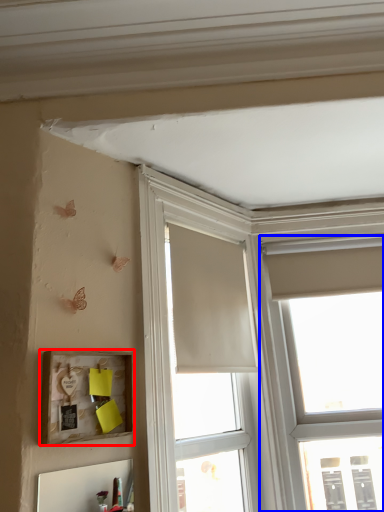
Question: Among these objects, which one is farthest to the camera, picture frame (highlighted by a red box) or window (highlighted by a blue box)?

Choices:
 (A) picture frame
 (B) window

Answer: (B)